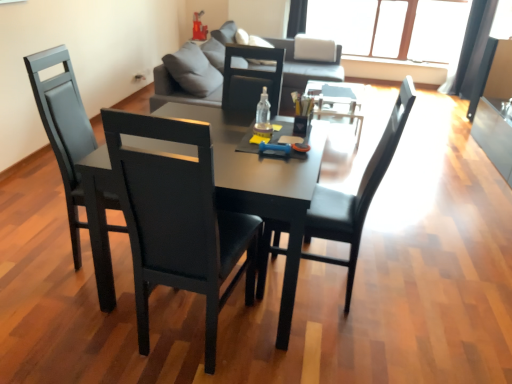
Locate an element on the screen. The image size is (512, 384). vacant area to the right of transparent plastic bottle at center is located at coordinates pos(286,126).